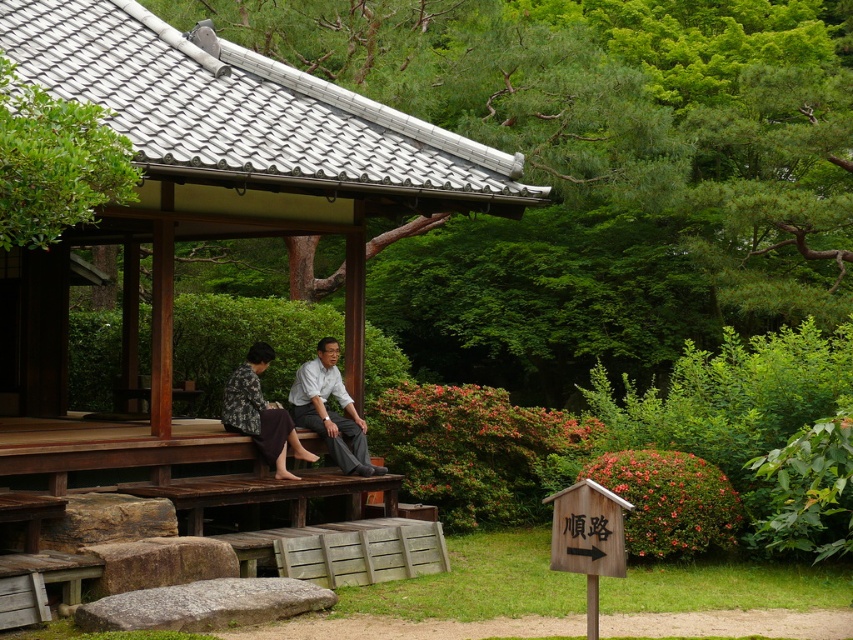
Which is more to the right, green leafy tree at upper left or matte gray pants at center?

Positioned to the right is matte gray pants at center.

Can you confirm if green leafy tree at upper left is wider than matte gray pants at center?

Incorrect, green leafy tree at upper left's width does not surpass matte gray pants at center's.

Which is in front, point (32, 236) or point (328, 387)?

Point (32, 236)

Identify the location of green leafy tree at upper left. Image resolution: width=853 pixels, height=640 pixels. point(54,163).

Where is `wooden gazebo at center`? The image size is (853, 640). wooden gazebo at center is located at coordinates (242, 156).

Which is above, wooden gazebo at center or matte gray pants at center?

wooden gazebo at center

Is point (202, 84) less distant than point (235, 384)?

No, (202, 84) is behind (235, 384).

This screenshot has height=640, width=853. What are the coordinates of `wooden gazebo at center` in the screenshot? It's located at (242, 156).

Does wooden gazebo at center have a larger size compared to green leafy tree at upper left?

No.

Locate an element on the screen. This screenshot has height=640, width=853. wooden gazebo at center is located at coordinates (242, 156).

Where is `wooden gazebo at center`? wooden gazebo at center is located at coordinates (242, 156).